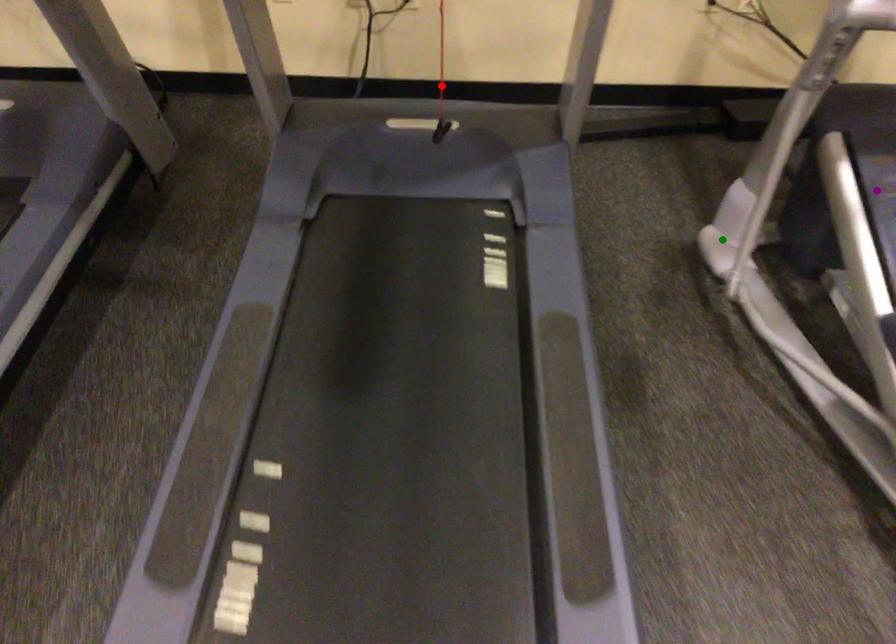
Order these from farthest to nearest:
red point | purple point | green point

red point → green point → purple point